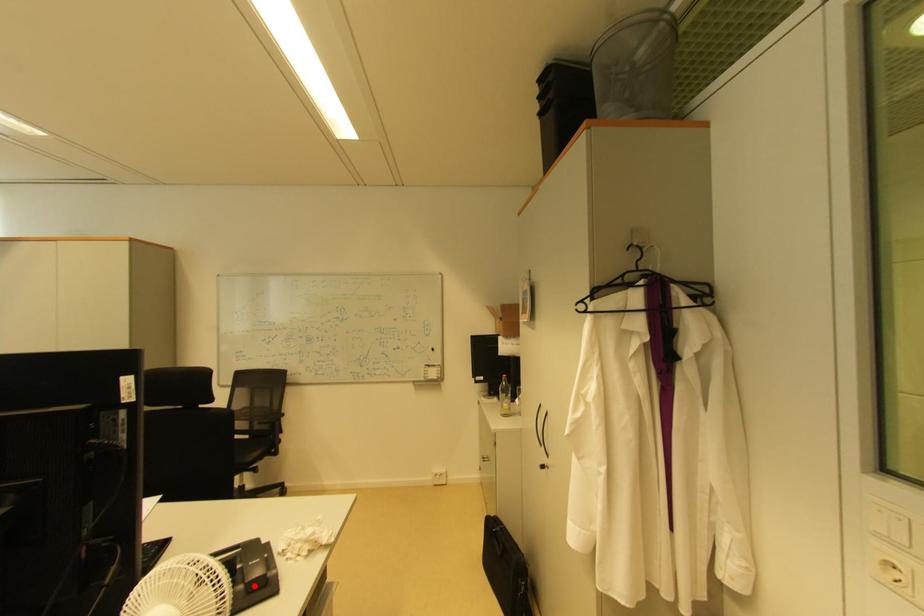
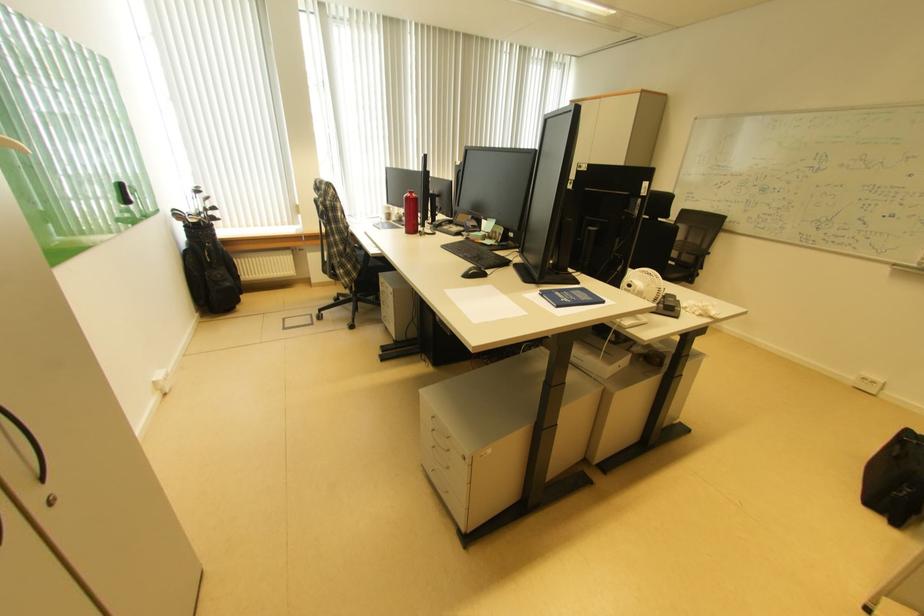
Question: I am providing you with two images of the same scene from different viewpoints. A red point is shown in image1. For the corresponding object point in image2, is it positioned nearer or farther from the camera?

Choices:
 (A) Nearer
 (B) Farther

Answer: (B)